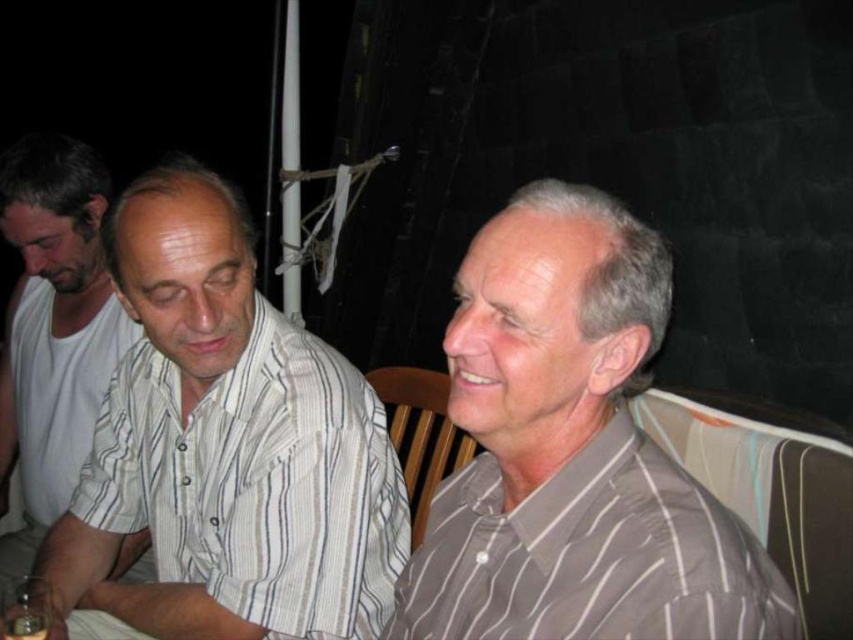
Question: Does white striped shirt at center appear on the left side of white striped shirt at left?

Choices:
 (A) yes
 (B) no

Answer: (B)

Question: Which object is farther from the camera taking this photo?

Choices:
 (A) gray striped shirt at right
 (B) white striped shirt at center
 (C) white striped shirt at left

Answer: (C)

Question: Estimate the real-world distances between objects in this image. Which object is closer to the white striped shirt at left?

Choices:
 (A) white striped shirt at center
 (B) gray striped shirt at right

Answer: (A)

Question: Considering the real-world distances, which object is farthest from the gray striped shirt at right?

Choices:
 (A) white striped shirt at left
 (B) white striped shirt at center

Answer: (A)

Question: In this image, where is white striped shirt at center located relative to gray striped shirt at right?

Choices:
 (A) left
 (B) right

Answer: (A)

Question: Is white striped shirt at center above gray striped shirt at right?

Choices:
 (A) yes
 (B) no

Answer: (A)